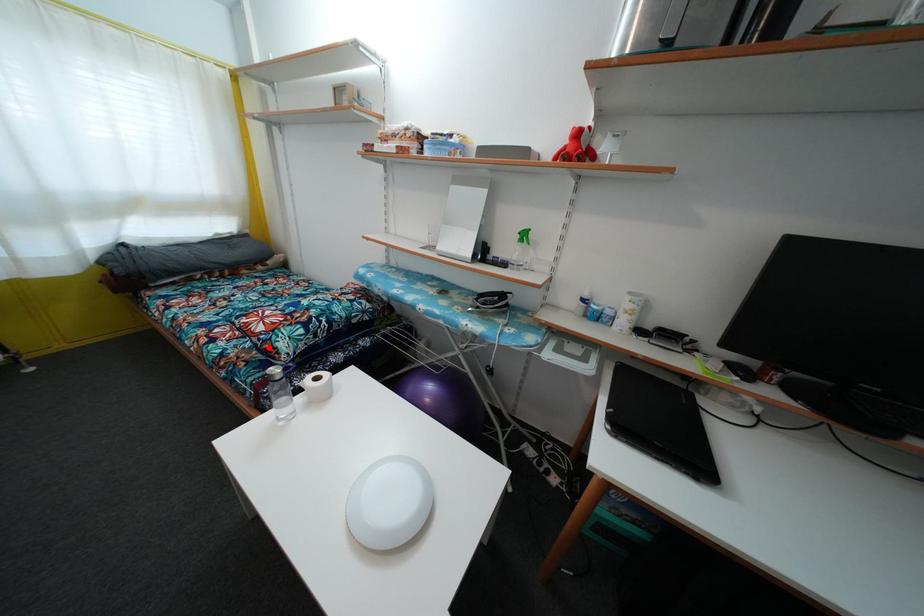
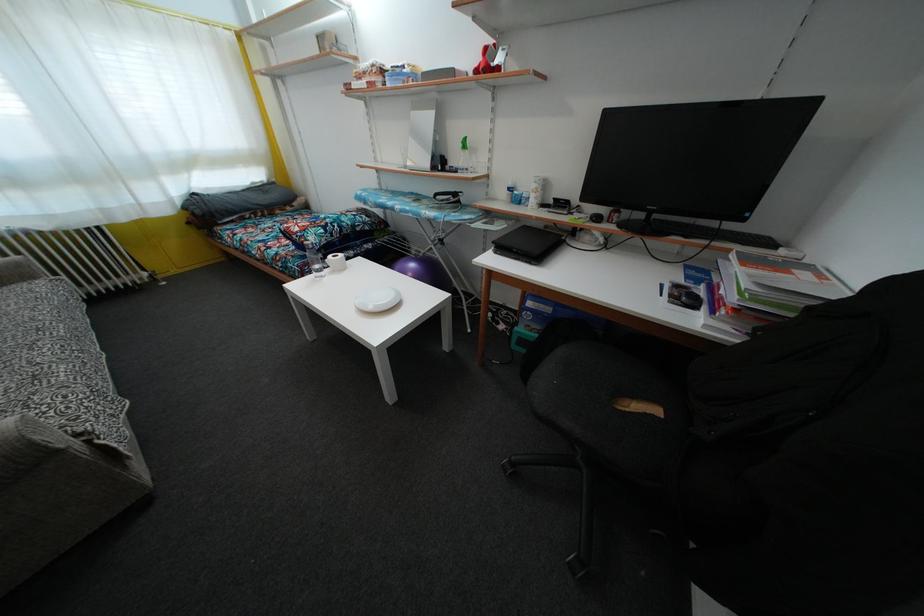
Question: A red point is marked in image1. In image2, is the corresponding 3D point closer to the camera or farther? Reply with the corresponding letter.

Choices:
 (A) The corresponding 3D point is closer.
 (B) The corresponding 3D point is farther.

Answer: (A)